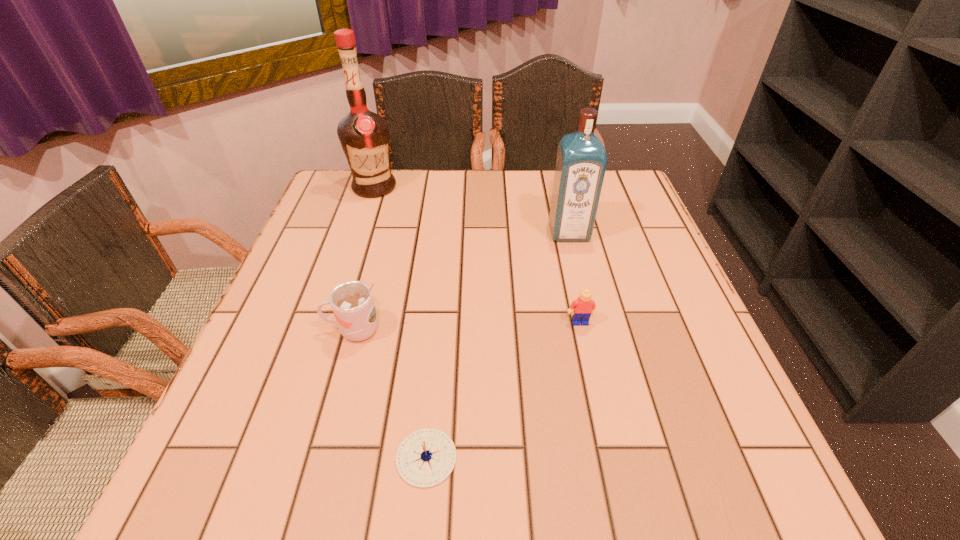
Identify the location of the taller liquor. (364, 136).

At what (x,y) coordinates should I click in order to perform the action: click on the tallest object. Please return your answer as a coordinate pair (x, y). Image resolution: width=960 pixels, height=540 pixels. Looking at the image, I should click on (364, 136).

I want to click on the fourth shortest object, so click(x=581, y=161).

Locate an element on the screen. the shorter liquor is located at coordinates (581, 161).

What are the coordinates of `cup` in the screenshot? It's located at (352, 302).

You are a GUI agent. You are given a task and a screenshot of the screen. Output one action in this format:
    pyautogui.click(x=<x>, y=<y>)
    Task: Click on the second shortest object
    This screenshot has width=960, height=540.
    Given the screenshot: What is the action you would take?
    pyautogui.click(x=584, y=307)

Locate an element on the screen. compass is located at coordinates [425, 458].

Locate an element on the screen. The image size is (960, 540). the shortest object is located at coordinates (425, 458).

Find the location of a particular element. Image resolution: width=960 pixels, height=540 pixels. vacant space situated 0.080m on the front and back of the taller liquor is located at coordinates (364, 217).

The height and width of the screenshot is (540, 960). Identify the location of vacant region located on the flat label side of the fourth shortest object. (586, 299).